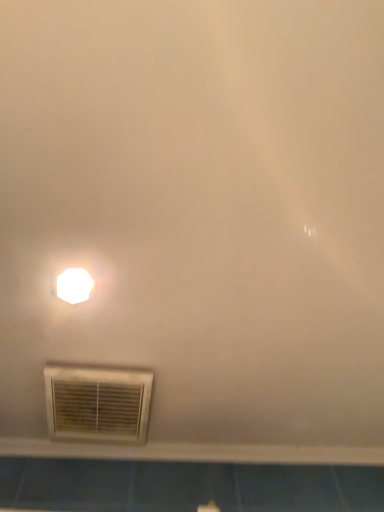
Question: From a real-world perspective, does white plastic window sill at lower center sit lower than white glossy light fixture at upper left?

Choices:
 (A) no
 (B) yes

Answer: (B)

Question: Is white plastic window sill at lower center beside white glossy light fixture at upper left?

Choices:
 (A) no
 (B) yes

Answer: (A)

Question: Is white plastic window sill at lower center far from white glossy light fixture at upper left?

Choices:
 (A) no
 (B) yes

Answer: (A)

Question: From a real-world perspective, is white plastic window sill at lower center over white glossy light fixture at upper left?

Choices:
 (A) no
 (B) yes

Answer: (A)

Question: From the image's perspective, does white plastic window sill at lower center appear lower than white glossy light fixture at upper left?

Choices:
 (A) no
 (B) yes

Answer: (B)

Question: Is white plastic window sill at lower center facing away from white glossy light fixture at upper left?

Choices:
 (A) yes
 (B) no

Answer: (B)

Question: Is white plastic window sill at lower center surrounding white plastic air conditioning at lower left?

Choices:
 (A) no
 (B) yes

Answer: (A)

Question: Can you confirm if white plastic window sill at lower center is wider than white plastic air conditioning at lower left?

Choices:
 (A) yes
 (B) no

Answer: (B)

Question: Considering the relative positions of white plastic window sill at lower center and white plastic air conditioning at lower left in the image provided, is white plastic window sill at lower center to the right of white plastic air conditioning at lower left from the viewer's perspective?

Choices:
 (A) no
 (B) yes

Answer: (B)

Question: Considering the relative sizes of white plastic window sill at lower center and white plastic air conditioning at lower left in the image provided, is white plastic window sill at lower center taller than white plastic air conditioning at lower left?

Choices:
 (A) no
 (B) yes

Answer: (B)

Question: Is the depth of white plastic window sill at lower center greater than that of white plastic air conditioning at lower left?

Choices:
 (A) yes
 (B) no

Answer: (A)

Question: Is the surface of white plastic window sill at lower center in direct contact with white plastic air conditioning at lower left?

Choices:
 (A) no
 (B) yes

Answer: (A)

Question: Can you confirm if white glossy light fixture at upper left is shorter than white plastic air conditioning at lower left?

Choices:
 (A) no
 (B) yes

Answer: (B)